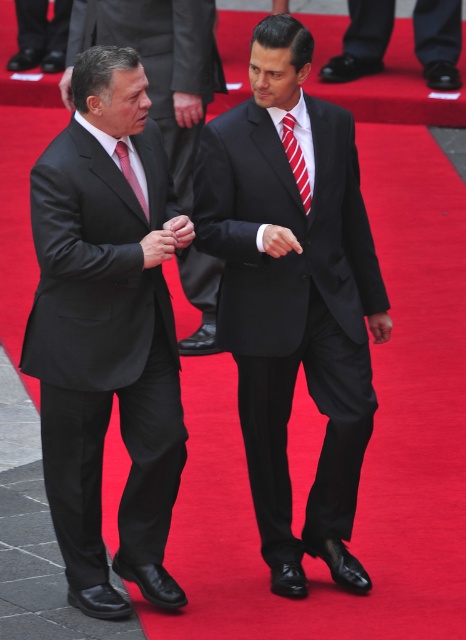
Question: Which of the following is the farthest from the observer?

Choices:
 (A) pyautogui.click(x=20, y=29)
 (B) pyautogui.click(x=97, y=330)
 (C) pyautogui.click(x=191, y=60)

Answer: (A)

Question: Does black satin suit at center have a larger size compared to black leather shoes at lower center?

Choices:
 (A) no
 (B) yes

Answer: (A)

Question: Is black satin suit at center above matte pink tie at left?

Choices:
 (A) yes
 (B) no

Answer: (B)

Question: Which of the following is the closest to the observer?

Choices:
 (A) matte black suit at left
 (B) black satin suit at center
 (C) black matte suit at center

Answer: (C)

Question: Which point is farther to the camera?

Choices:
 (A) matte black suit at left
 (B) black satin suit at center

Answer: (A)

Question: Is black matte suit at center below black leather shoes at lower left?

Choices:
 (A) yes
 (B) no

Answer: (A)